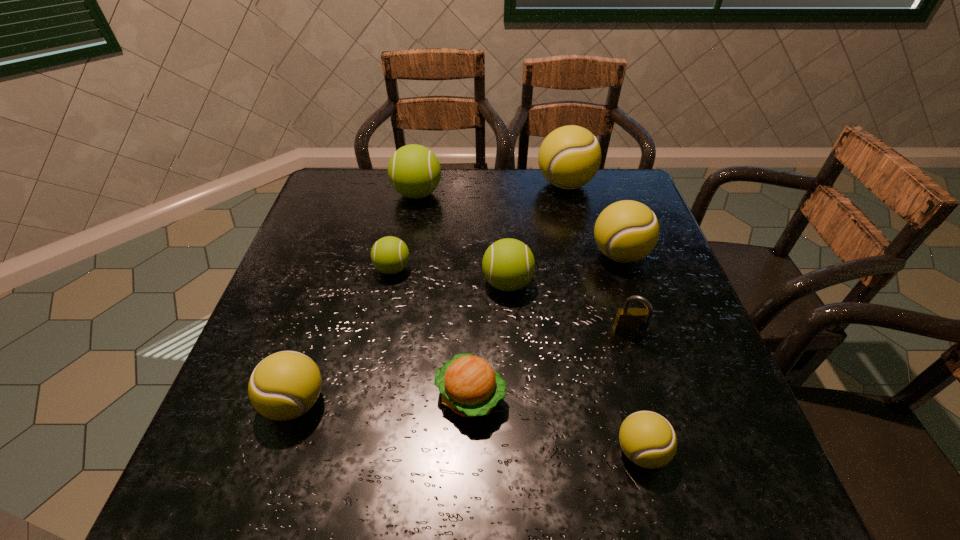
I want to click on the smallest green tennis ball, so coord(389,255).

Locate an element on the screen. This screenshot has height=540, width=960. the smallest yellow tennis ball is located at coordinates (648, 440).

You are a GUI agent. You are given a task and a screenshot of the screen. Output one action in this format:
    pyautogui.click(x=<x>, y=<y>)
    Task: Click on the vacant point located on the front of the tallest tennis ball
    Image resolution: width=960 pixels, height=540 pixels.
    Given the screenshot: What is the action you would take?
    pyautogui.click(x=583, y=255)

Find the location of a particular element. free spot located on the right of the biggest green tennis ball is located at coordinates (531, 194).

Locate an element on the screen. This screenshot has height=540, width=960. vacant space located 0.140m on the back of the third nearest yellow tennis ball is located at coordinates (603, 205).

Find the location of a particular element. vacant space located 0.300m on the right of the fourth tennis ball from right to left is located at coordinates (660, 284).

Locate an element on the screen. The height and width of the screenshot is (540, 960). vacant point located on the right of the second smallest yellow tennis ball is located at coordinates (371, 403).

Identify the location of free spot located on the side with the combination dials of the fourth nearest object. This screenshot has width=960, height=540. (658, 423).

This screenshot has width=960, height=540. Identify the location of vacant space positioned 0.230m on the back of the hamburger. click(x=472, y=285).

You are a GUI agent. You are given a task and a screenshot of the screen. Output one action in this format:
    pyautogui.click(x=<x>, y=<y>)
    Task: Click on the vacant area situated on the front of the smallest green tennis ball
    The height and width of the screenshot is (540, 960).
    Given the screenshot: What is the action you would take?
    pyautogui.click(x=362, y=420)